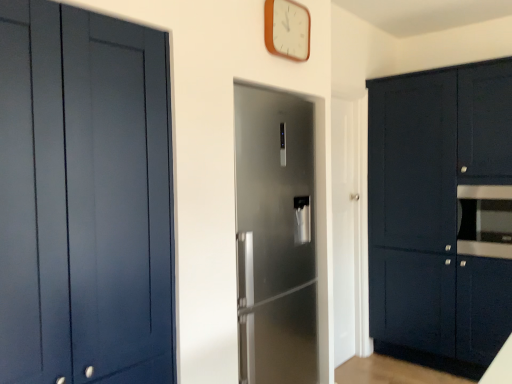
Question: Is matte dark blue cabinets at right, which ranks as the 1th cabinetry in back-to-front order, shorter than satin silver refrigerator at center, the 2th door positioned from the back?

Choices:
 (A) no
 (B) yes

Answer: (A)

Question: Is matte dark blue cabinets at right, the second cabinetry positioned from the left, further to the viewer compared to satin silver refrigerator at center, the second door positioned from the right?

Choices:
 (A) yes
 (B) no

Answer: (A)

Question: Is matte dark blue cabinets at right, the first cabinetry in the right-to-left sequence, at the right side of satin silver refrigerator at center, which is the 1th door in front-to-back order?

Choices:
 (A) no
 (B) yes

Answer: (B)

Question: Is matte dark blue cabinets at right, the first cabinetry in the right-to-left sequence, positioned beyond the bounds of satin silver refrigerator at center, which is the 1th door in front-to-back order?

Choices:
 (A) no
 (B) yes

Answer: (B)

Question: Is the depth of matte dark blue cabinets at right, the first cabinetry in the right-to-left sequence, less than that of satin silver refrigerator at center, which is the 1th door in front-to-back order?

Choices:
 (A) no
 (B) yes

Answer: (A)

Question: Can you confirm if matte dark blue cabinets at right, the second cabinetry positioned from the left, is thinner than satin silver refrigerator at center, the 1th door in the left-to-right sequence?

Choices:
 (A) no
 (B) yes

Answer: (A)

Question: Is matte blue cabinet at left, which is the 2th cabinetry from back to front, facing away from white glossy door at center, the 1th door positioned from the back?

Choices:
 (A) yes
 (B) no

Answer: (B)

Question: Does matte blue cabinet at left, the first cabinetry in the left-to-right sequence, have a greater width compared to white glossy door at center, marked as the 2th door in a left-to-right arrangement?

Choices:
 (A) no
 (B) yes

Answer: (A)

Question: Is matte blue cabinet at left, the first cabinetry in the left-to-right sequence, far from white glossy door at center, placed as the 2th door when sorted from front to back?

Choices:
 (A) yes
 (B) no

Answer: (A)

Question: Does matte blue cabinet at left, which is the 2th cabinetry from back to front, lie in front of white glossy door at center, placed as the 2th door when sorted from front to back?

Choices:
 (A) no
 (B) yes

Answer: (B)

Question: Is matte blue cabinet at left, the first cabinetry in the left-to-right sequence, aimed at white glossy door at center, placed as the 2th door when sorted from front to back?

Choices:
 (A) yes
 (B) no

Answer: (B)

Question: Does matte blue cabinet at left, which appears as the 1th cabinetry when viewed from the front, have a greater height compared to white glossy door at center, placed as the 2th door when sorted from front to back?

Choices:
 (A) yes
 (B) no

Answer: (B)

Question: From the image's perspective, is satin black oven at right under white glossy door at center, marked as the 2th door in a left-to-right arrangement?

Choices:
 (A) no
 (B) yes

Answer: (A)